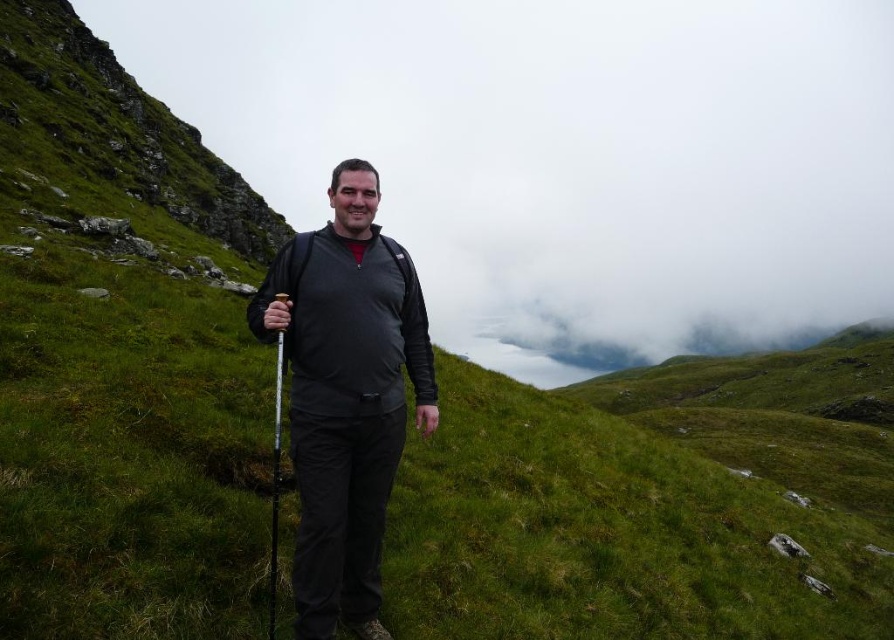
From the picture: Can you confirm if matte black jacket at center is positioned above white plastic ski pole at center?

Correct, matte black jacket at center is located above white plastic ski pole at center.

Is matte black jacket at center closer to the viewer compared to white plastic ski pole at center?

No, matte black jacket at center is behind white plastic ski pole at center.

Find the location of `matte black jacket at center`. matte black jacket at center is located at coordinates (346, 396).

Where is `matte black jacket at center`? The height and width of the screenshot is (640, 894). matte black jacket at center is located at coordinates (346, 396).